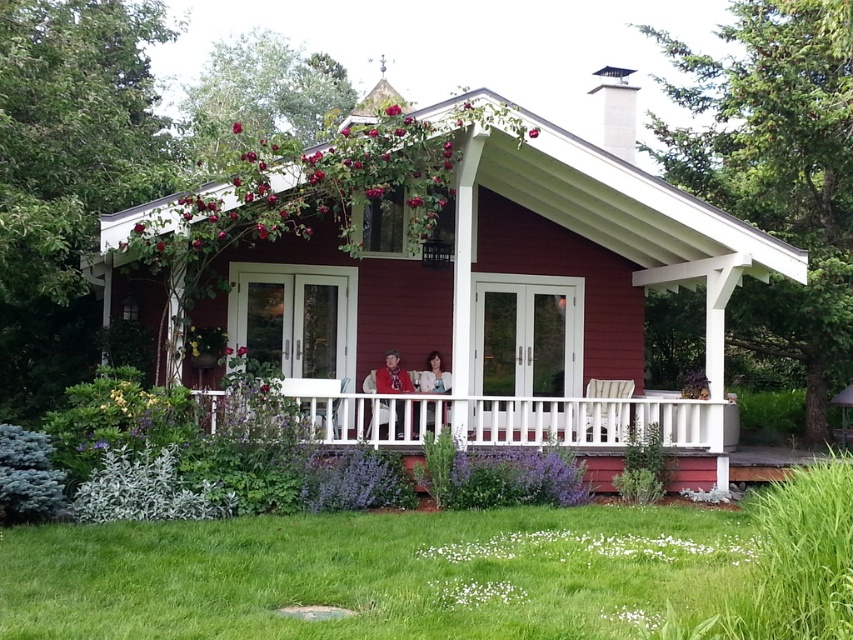
You are standing in front of the red house and want to take a photo. There are two points marked in the scene, point (669, 570) and point (140, 230). Which point is closer to your camera?

Point (669, 570) is closer to the camera than point (140, 230).

You are standing on the porch of the small red house and want to place a small potted plant exactly at the position where the green grass at lower center is located. According to the image, what are the coordinates of the location where you should place the potted plant?

The coordinates for the green grass at lower center are at point (x=447, y=572), so you should place the potted plant at those coordinates.